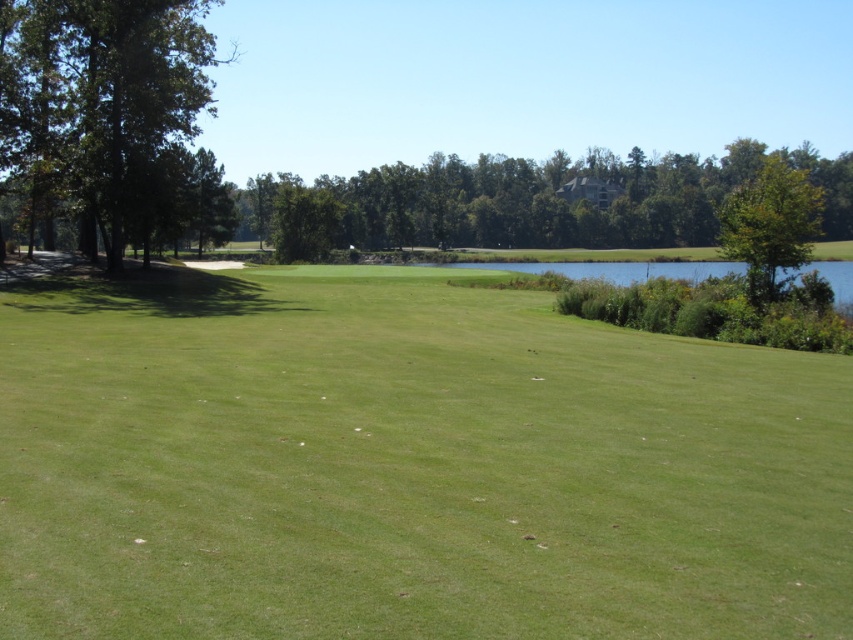
You are a golfer trying to hit a ball from the green leafy tree at center to the green leafy tree at upper right. Which tree will require a longer shot due to its size?

The green leafy tree at center has a larger size compared to the green leafy tree at upper right, so you will need to hit a longer shot to reach the green leafy tree at center.

You are a golfer standing on the fairway and want to walk towards the green leafy tree at upper right. Which direction should you move relative to the green leafy tree at center?

To reach the green leafy tree at upper right, you should move away from the green leafy tree at center since the green leafy tree at upper right is further away from you than the green leafy tree at center.